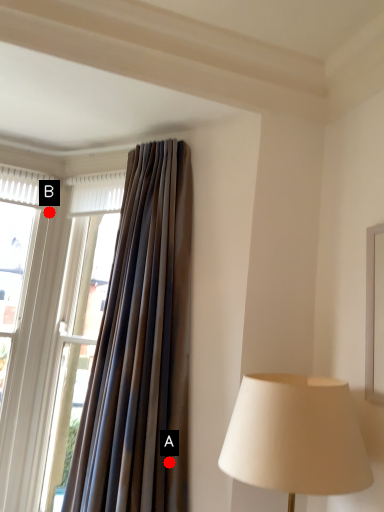
Question: Two points are circled on the image, labeled by A and B beside each circle. Which point is farther to the camera?

Choices:
 (A) A is further
 (B) B is further

Answer: (B)